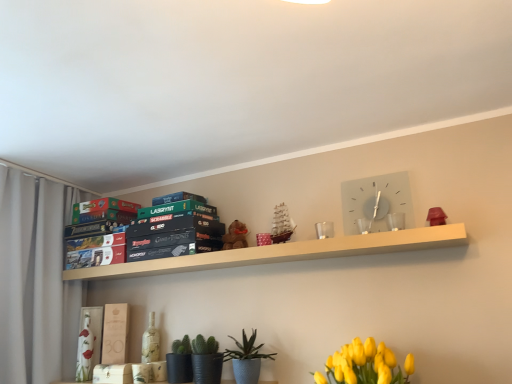
This screenshot has width=512, height=384. Describe the element at coordinates (365, 365) in the screenshot. I see `yellow matte flower at lower right` at that location.

Where is `textured blue pot at lower center, the 2th plant positioned from the left`? textured blue pot at lower center, the 2th plant positioned from the left is located at coordinates (246, 359).

The width and height of the screenshot is (512, 384). Find the location of `green matte cactus at lower center, which appears as the 1th plant when viewed from the left`. green matte cactus at lower center, which appears as the 1th plant when viewed from the left is located at coordinates (195, 360).

This screenshot has width=512, height=384. What do you see at coordinates (195, 360) in the screenshot?
I see `green matte cactus at lower center, the 2th plant from the right` at bounding box center [195, 360].

What is the approximate height of green matte board game at upper center, the 1th paperback book in the top-to-bottom sequence?

green matte board game at upper center, the 1th paperback book in the top-to-bottom sequence, is 2.28 inches tall.

Describe the element at coordinates (95, 251) in the screenshot. This screenshot has height=384, width=512. I see `matte board game at upper left, the second paperback book from the bottom` at that location.

Image resolution: width=512 pixels, height=384 pixels. What do you see at coordinates (177, 226) in the screenshot?
I see `green matte board game at upper left, the 2th paperback book viewed from the top` at bounding box center [177, 226].

Identify the location of green matte board game at upper left, the 2th paperback book viewed from the top. Image resolution: width=512 pixels, height=384 pixels. (177, 226).

The width and height of the screenshot is (512, 384). Identify the location of white fabric curtain at left. pyautogui.click(x=35, y=281).

Would you consider textured blue pot at lower center, the 2th plant positioned from the left, to be distant from white wooden shelf at upper center?

That's not correct — textured blue pot at lower center, the 2th plant positioned from the left, is a little close to white wooden shelf at upper center.

Which is less distant, (245, 350) or (225, 261)?

Clearly, point (245, 350) is more distant from the camera than point (225, 261).

Is textured blue pot at lower center, arranged as the 1th plant when viewed from the right, to the left of white wooden shelf at upper center from the viewer's perspective?

Incorrect, textured blue pot at lower center, arranged as the 1th plant when viewed from the right, is not on the left side of white wooden shelf at upper center.

From a real-world perspective, is textured blue pot at lower center, arranged as the 1th plant when viewed from the right, above or below white wooden shelf at upper center?

From a real-world perspective, textured blue pot at lower center, arranged as the 1th plant when viewed from the right, is physically below white wooden shelf at upper center.

Looking at this image, considering the sizes of objects textured blue pot at lower center, the 2th plant positioned from the left, and matte board game at upper left, the second paperback book from the bottom, in the image provided, who is smaller, textured blue pot at lower center, the 2th plant positioned from the left, or matte board game at upper left, the second paperback book from the bottom,?

textured blue pot at lower center, the 2th plant positioned from the left, is smaller.

At what (x,y) coordinates should I click in order to perform the action: click on the 1st paperback book above the textured blue pot at lower center, the 2th plant positioned from the left (from the image's perspective). Please return your answer as a coordinate pair (x, y). The height and width of the screenshot is (384, 512). Looking at the image, I should click on (95, 251).

From the image's perspective, between textured blue pot at lower center, arranged as the 1th plant when viewed from the right, and matte board game at upper left, the second paperback book from the bottom, which one is located above?

matte board game at upper left, the second paperback book from the bottom, from the image's perspective.

From the picture: Can you tell me how much textured blue pot at lower center, arranged as the 1th plant when viewed from the right, and matte board game at upper left, the 3th paperback book from the top, differ in facing direction?

There is a 2.66-degree angle between the facing directions of textured blue pot at lower center, arranged as the 1th plant when viewed from the right, and matte board game at upper left, the 3th paperback book from the top.

Considering the sizes of matte board game at upper left, the second paperback book from the bottom, and brown plush bear at center in the image, is matte board game at upper left, the second paperback book from the bottom, bigger or smaller than brown plush bear at center?

In the image, matte board game at upper left, the second paperback book from the bottom, appears to be larger than brown plush bear at center.

Would you say matte board game at upper left, the second paperback book from the bottom, is to the left or to the right of brown plush bear at center in the picture?

In the image, matte board game at upper left, the second paperback book from the bottom, appears on the left side of brown plush bear at center.

Is matte board game at upper left, the second paperback book from the bottom, directly adjacent to brown plush bear at center?

No, matte board game at upper left, the second paperback book from the bottom, is not with brown plush bear at center.

Can you confirm if matte board game at upper left, the 3th paperback book from the top, is wider than brown plush bear at center?

Correct, the width of matte board game at upper left, the 3th paperback book from the top, exceeds that of brown plush bear at center.

Consider the image. Is yellow matte flower at lower right not inside white wooden shelf at upper center?

Indeed, yellow matte flower at lower right is completely outside white wooden shelf at upper center.

From the image's perspective, is yellow matte flower at lower right on white wooden shelf at upper center?

No, from the image's perspective, yellow matte flower at lower right is not above white wooden shelf at upper center.

The height and width of the screenshot is (384, 512). I want to click on clock above the green matte cactus at lower center, the 2th plant from the right (from the image's perspective), so click(x=374, y=201).

Does white glass clock at upper center have a lesser height compared to green matte cactus at lower center, the 2th plant from the right?

Incorrect, the height of white glass clock at upper center does not fall short of that of green matte cactus at lower center, the 2th plant from the right.

From the image's perspective, would you say white glass clock at upper center is shown under green matte cactus at lower center, the 2th plant from the right?

No.

Which of these two, white glass clock at upper center or green matte cactus at lower center, the 2th plant from the right, is wider?

With larger width is green matte cactus at lower center, the 2th plant from the right.

Are white wooden shelf at upper center and yellow matte flower at lower right making contact?

No.

Is white wooden shelf at upper center positioned with its back to yellow matte flower at lower right?

No, white wooden shelf at upper center's orientation is not away from yellow matte flower at lower right.

The width and height of the screenshot is (512, 384). What are the coordinates of `shelf on the left of yellow matte flower at lower right` in the screenshot? It's located at (284, 253).

Which point is more distant from viewer, (365, 239) or (334, 354)?

The point (334, 354) is more distant.

Can you confirm if yellow matte flower at lower right is bigger than white glass clock at upper center?

Yes, yellow matte flower at lower right is bigger than white glass clock at upper center.

Can we say yellow matte flower at lower right lies outside white glass clock at upper center?

Yes, yellow matte flower at lower right is located beyond the bounds of white glass clock at upper center.

Which object is wider, yellow matte flower at lower right or white glass clock at upper center?

With larger width is yellow matte flower at lower right.

Does yellow matte flower at lower right come in front of white glass clock at upper center?

Yes, yellow matte flower at lower right is in front of white glass clock at upper center.

Identify the location of shelf that is on the left side of textured blue pot at lower center, arranged as the 1th plant when viewed from the right. Image resolution: width=512 pixels, height=384 pixels. (284, 253).

Locate an element on the screen. This screenshot has height=384, width=512. the 2nd paperback book above the textured blue pot at lower center, arranged as the 1th plant when viewed from the right (from a real-world perspective) is located at coordinates (95, 251).

Considering their positions, is white matte bottle at lower center positioned closer to green matte board game at upper center, the 1th paperback book in the top-to-bottom sequence, than white fabric curtain at left?

white matte bottle at lower center lies closer to green matte board game at upper center, the 1th paperback book in the top-to-bottom sequence, than the other object.

Looking at the image, which one is located closer to white fabric curtain at left, brown plush bear at center or green matte board game at upper center, the fourth paperback book when ordered from bottom to top?

green matte board game at upper center, the fourth paperback book when ordered from bottom to top, lies closer to white fabric curtain at left than the other object.

When comparing their distances from textured blue pot at lower center, the 2th plant positioned from the left, does yellow matte flower at lower right or white matte bottle at lower center seem further?

yellow matte flower at lower right.

Based on the photo, estimate the real-world distances between objects in this image. Which object is further from white fabric curtain at left, green matte cactus at lower center, the 2th plant from the right, or matte white book at center, which is the 1th paperback book from bottom to top?

Based on the image, green matte cactus at lower center, the 2th plant from the right, appears to be further to white fabric curtain at left.

From the image, which object appears to be farther from yellow matte flower at lower right, green matte cactus at lower center, the 2th plant from the right, or textured blue pot at lower center, the 2th plant positioned from the left?

The object further to yellow matte flower at lower right is green matte cactus at lower center, the 2th plant from the right.

From the picture: Which object lies nearer to the anchor point textured blue pot at lower center, the 2th plant positioned from the left, matte board game at upper left, the 3th paperback book from the top, or green matte board game at upper center, the 1th paperback book in the top-to-bottom sequence?

green matte board game at upper center, the 1th paperback book in the top-to-bottom sequence, is closer to textured blue pot at lower center, the 2th plant positioned from the left.

Considering their positions, is brown plush bear at center positioned further to white glass clock at upper center than yellow matte flower at lower right?

brown plush bear at center is positioned further to the anchor white glass clock at upper center.

Considering their positions, is white glass clock at upper center positioned closer to brown plush bear at center than green matte cactus at lower center, the 2th plant from the right?

green matte cactus at lower center, the 2th plant from the right, lies closer to brown plush bear at center than the other object.

This screenshot has width=512, height=384. Find the location of `plant that lies between white wooden shelf at upper center and green matte cactus at lower center, which appears as the 1th plant when viewed from the left, from top to bottom`. plant that lies between white wooden shelf at upper center and green matte cactus at lower center, which appears as the 1th plant when viewed from the left, from top to bottom is located at coordinates (246, 359).

Locate an element on the screen. This screenshot has height=384, width=512. toy situated between white fabric curtain at left and white glass clock at upper center from left to right is located at coordinates (234, 236).

Where is `paperback book between green matte board game at upper left, the 2th paperback book viewed from the top, and matte white book at center, which is the 1th paperback book from bottom to top, in the up-down direction`? This screenshot has height=384, width=512. paperback book between green matte board game at upper left, the 2th paperback book viewed from the top, and matte white book at center, which is the 1th paperback book from bottom to top, in the up-down direction is located at coordinates (95, 251).

Locate an element on the screen. bottle between white fabric curtain at left and white glass clock at upper center from left to right is located at coordinates (151, 342).